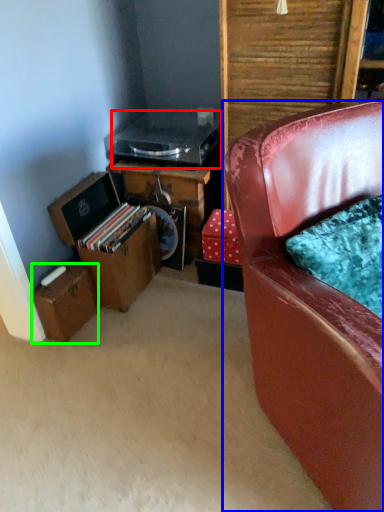
Question: Estimate the real-world distances between objects in this image. Which object is farther from appliance (highlighted by a red box), chair (highlighted by a blue box) or box (highlighted by a green box)?

Choices:
 (A) chair
 (B) box

Answer: (A)